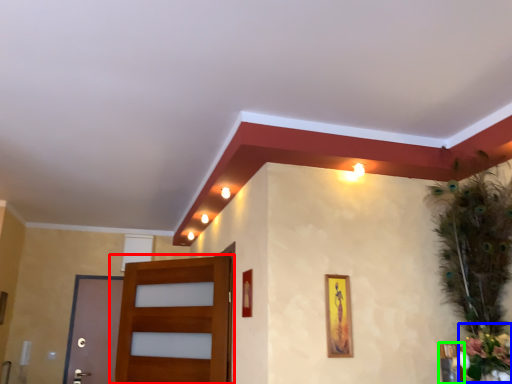
Question: Considering the real-world distances, which object is farthest from door (highlighted by a red box)? flower (highlighted by a blue box) or picture frame (highlighted by a green box)?

Choices:
 (A) flower
 (B) picture frame

Answer: (A)